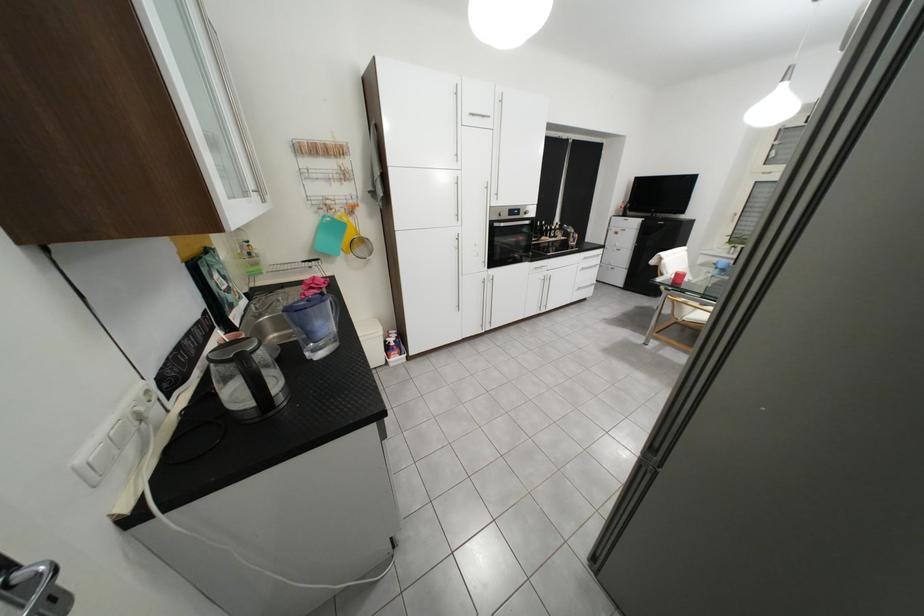
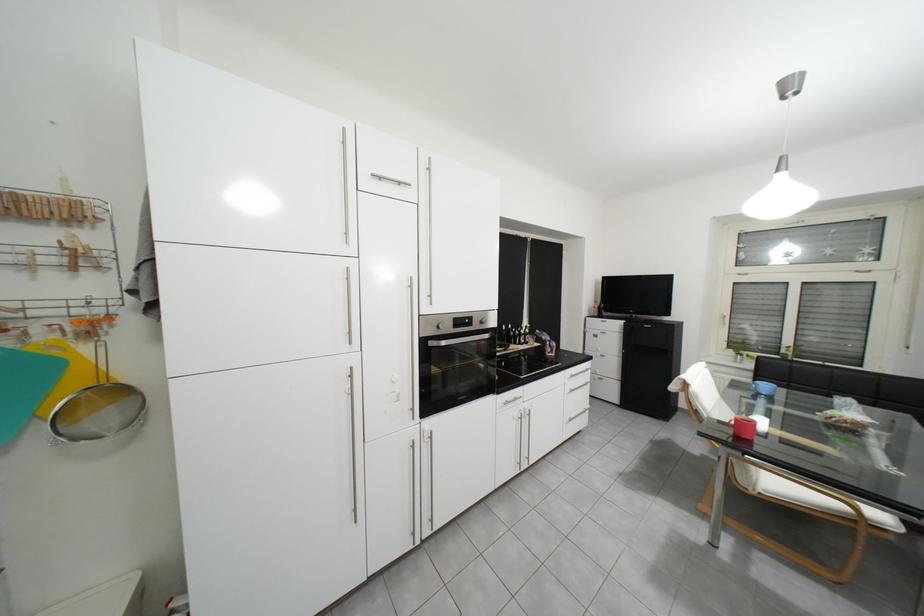
Question: Which direction would the cameraman need to move to produce the second image? Reply with the corresponding letter.

Choices:
 (A) Left
 (B) Right
 (C) Forward
 (D) Backward

Answer: (C)